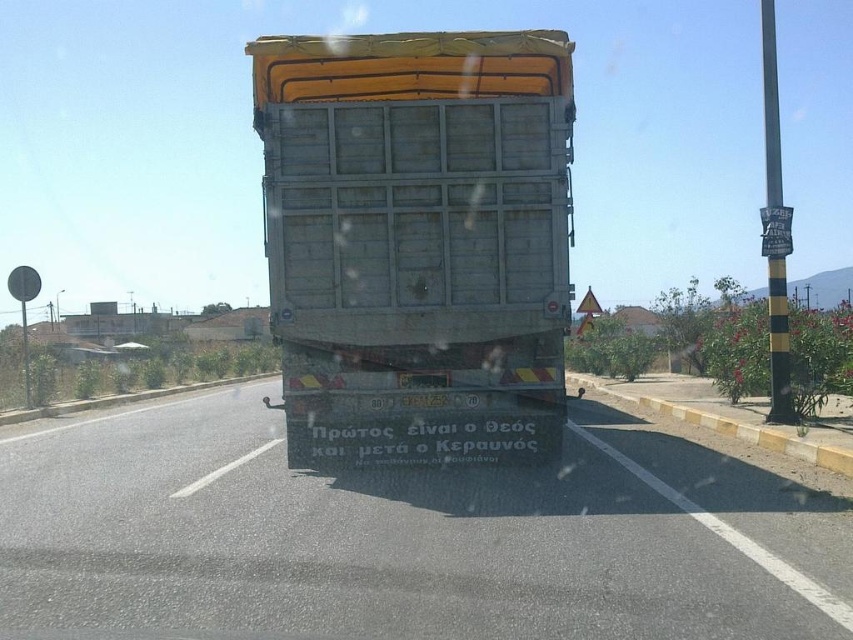
You are a driver following a metallic truck at center and a rusty metal trailer truck at center on a highway. You need to maintain a safe distance of at least 3 meters between your car and the vehicle in front. Which truck should you follow to comply with the safety rule?

You should follow the rusty metal trailer truck at center because the distance between the metallic truck at center and the rusty metal trailer truck at center is 2.64 meters, which is less than the required 3 meters. Following the rusty metal trailer truck at center would allow you to maintain a safer distance from the vehicle ahead.